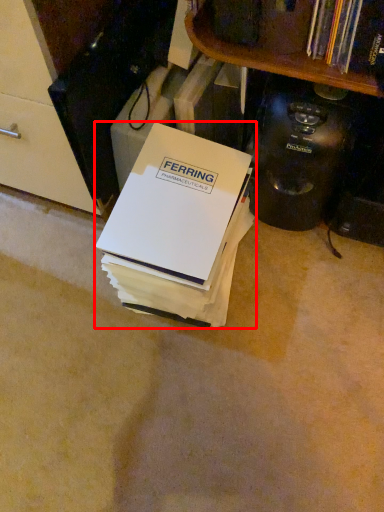
Question: From the image's perspective, what is the correct spatial positioning of box (annotated by the red box) in reference to appliance?

Choices:
 (A) below
 (B) above

Answer: (A)